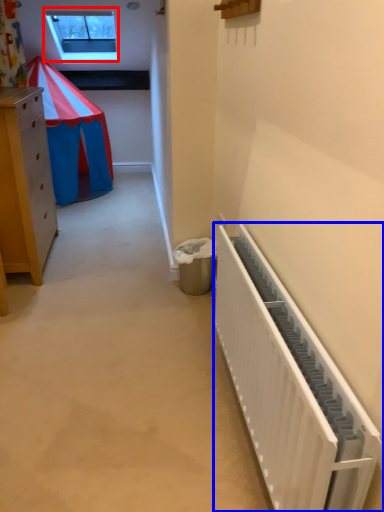
Question: Which point is closer to the camera, window (highlighted by a red box) or radiator (highlighted by a blue box)?

Choices:
 (A) window
 (B) radiator

Answer: (B)